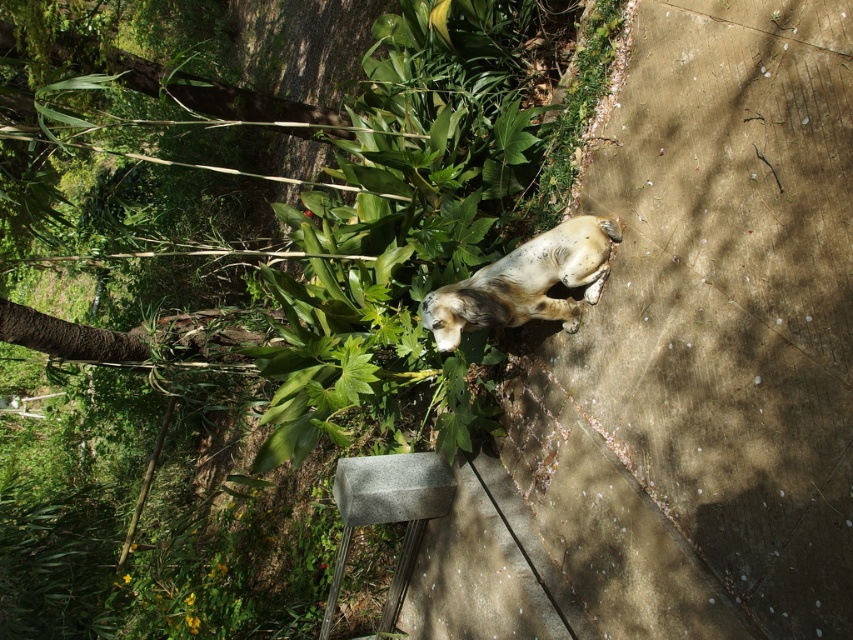
You are standing at the point labeled point (582, 244) and want to walk to the point labeled point (339, 480). Given that both points are on the concrete pathway, which direction should you face to walk directly towards your destination?

You should face towards the top right direction because point (339, 480) is located at the top right relative to point (582, 244) on the concrete pathway.

You are a photographer trying to capture the speckled fur dog at center and the gray concrete block at lower center in the same frame. Based on their positions, can you tell if the dog is lying on the block or just near it?

The speckled fur dog at center is positioned over gray concrete block at lower center, so the dog is lying on the block.